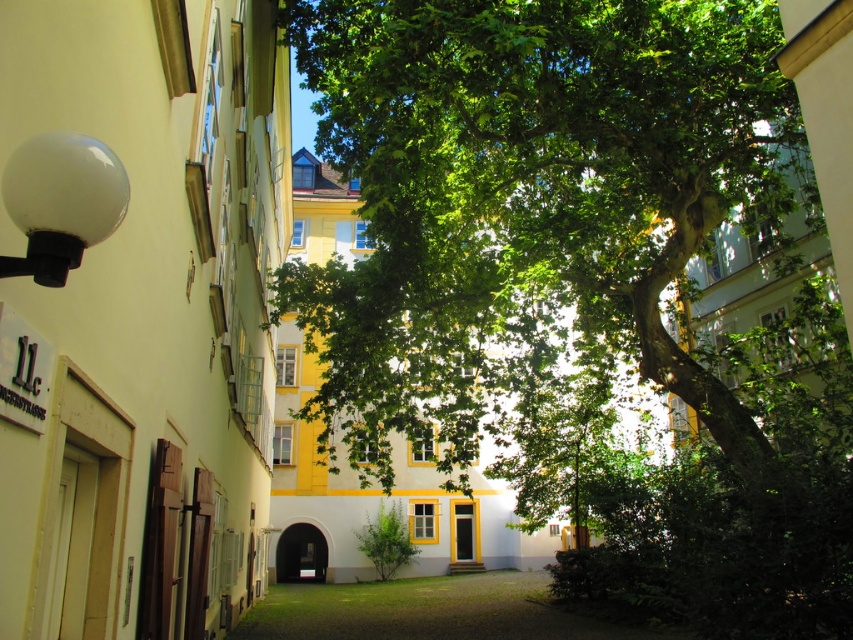
Question: Can you confirm if green leafy tree at center is thinner than green grass at center?

Choices:
 (A) yes
 (B) no

Answer: (B)

Question: Can you confirm if green leafy tree at center is smaller than green grass at center?

Choices:
 (A) no
 (B) yes

Answer: (A)

Question: Which point is closer to the camera?

Choices:
 (A) (318, 614)
 (B) (364, 129)

Answer: (B)

Question: Is green leafy tree at center to the right of green grass at center from the viewer's perspective?

Choices:
 (A) no
 (B) yes

Answer: (B)

Question: Which point is closer to the camera?

Choices:
 (A) (633, 170)
 (B) (463, 582)

Answer: (A)